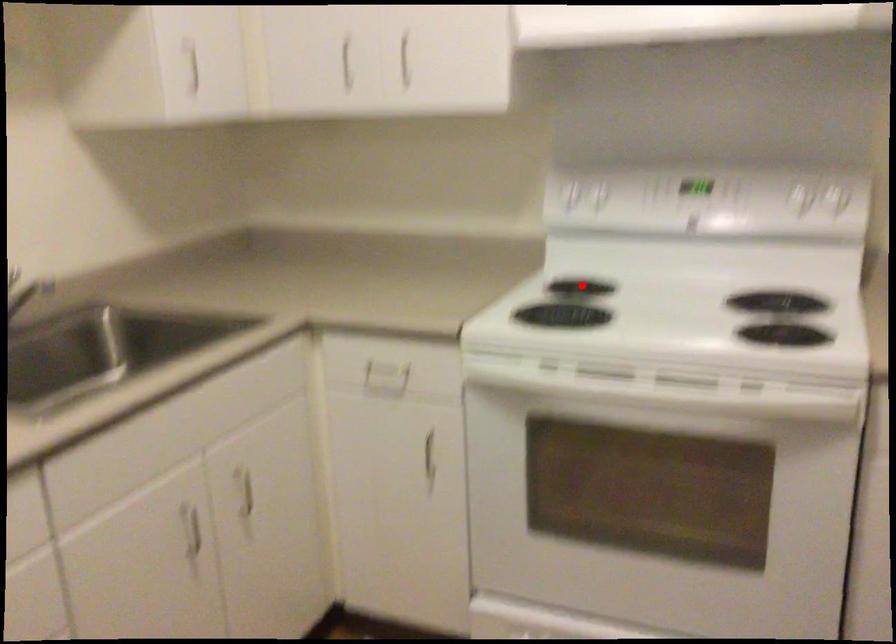
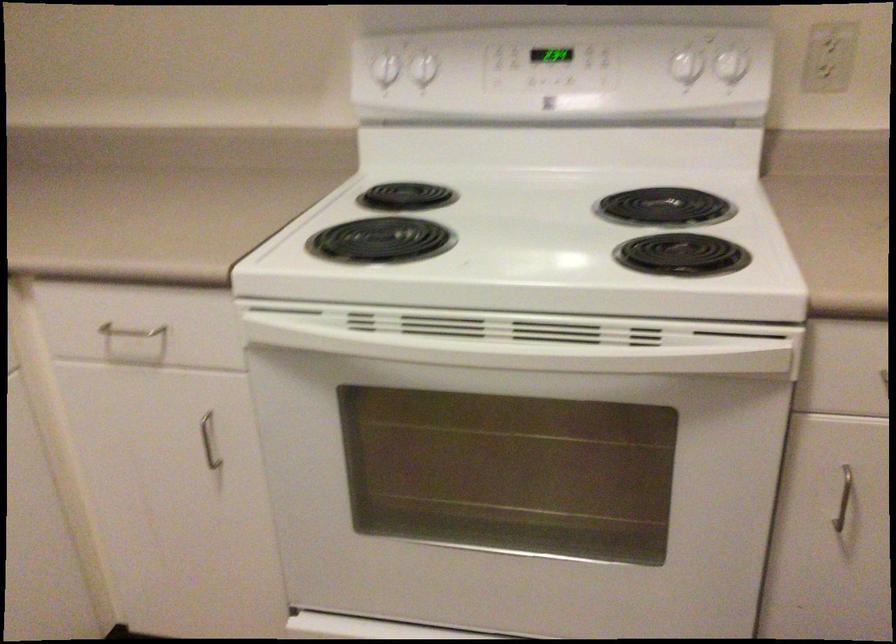
Find the pixel in the second image that matches the highlighted location in the first image.

(407, 196)